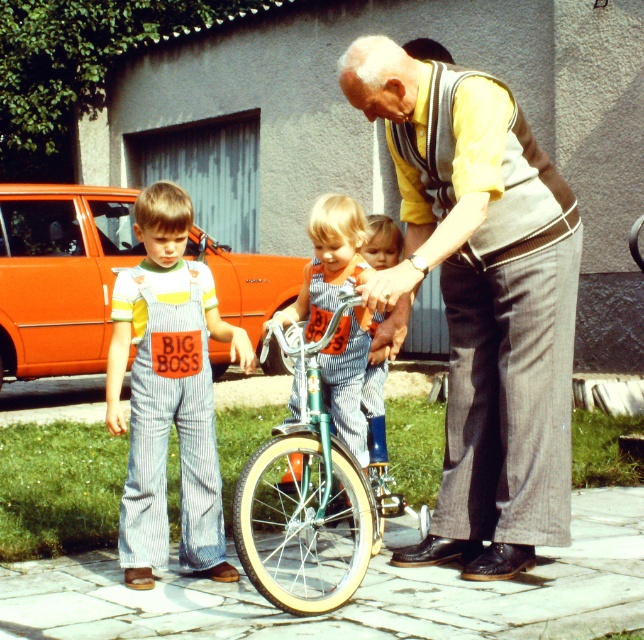
Question: Which point is closer to the camera?

Choices:
 (A) striped denim overalls at center
 (B) yellow striped vest at center
 (C) denim overalls at center

Answer: (B)

Question: Can you confirm if yellow striped vest at center is smaller than denim overalls at center?

Choices:
 (A) yes
 (B) no

Answer: (B)

Question: From the image, what is the correct spatial relationship of green metallic bicycle at center in relation to striped denim overalls at center?

Choices:
 (A) below
 (B) above

Answer: (A)

Question: Which object is farther from the camera taking this photo?

Choices:
 (A) denim overalls at center
 (B) green metallic bicycle at center
 (C) yellow striped vest at center

Answer: (A)

Question: Does yellow striped vest at center have a smaller size compared to denim overalls at center?

Choices:
 (A) yes
 (B) no

Answer: (B)

Question: Which of the following is the closest to the observer?

Choices:
 (A) (355, 406)
 (B) (242, 515)
 (C) (140, 378)

Answer: (B)